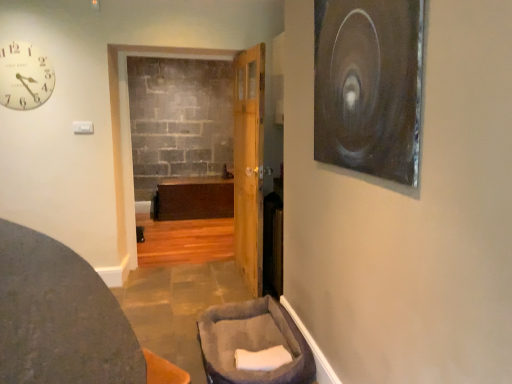
Question: Relative to dark gray fabric ottoman at lower left, which is the second furniture in right-to-left order, is matte white clock at upper left in front or behind?

Choices:
 (A) front
 (B) behind

Answer: (B)

Question: Looking at their shapes, would you say matte white clock at upper left is wider or thinner than dark gray fabric ottoman at lower left, the first furniture positioned from the left?

Choices:
 (A) thin
 (B) wide

Answer: (A)

Question: Considering the real-world distances, which object is farthest from the dark gray fabric ottoman at lower left, which is the second furniture in right-to-left order?

Choices:
 (A) wooden door at center
 (B) gray plush pet bed at lower center, arranged as the first furniture when viewed from the right
 (C) matte white clock at upper left
 (D) metallic silver circular object at upper right

Answer: (A)

Question: Based on their relative distances, which object is farther from the dark gray fabric ottoman at lower left, which is the second furniture in right-to-left order?

Choices:
 (A) matte white clock at upper left
 (B) gray plush pet bed at lower center, arranged as the first furniture when viewed from the right
 (C) metallic silver circular object at upper right
 (D) wooden door at center

Answer: (D)